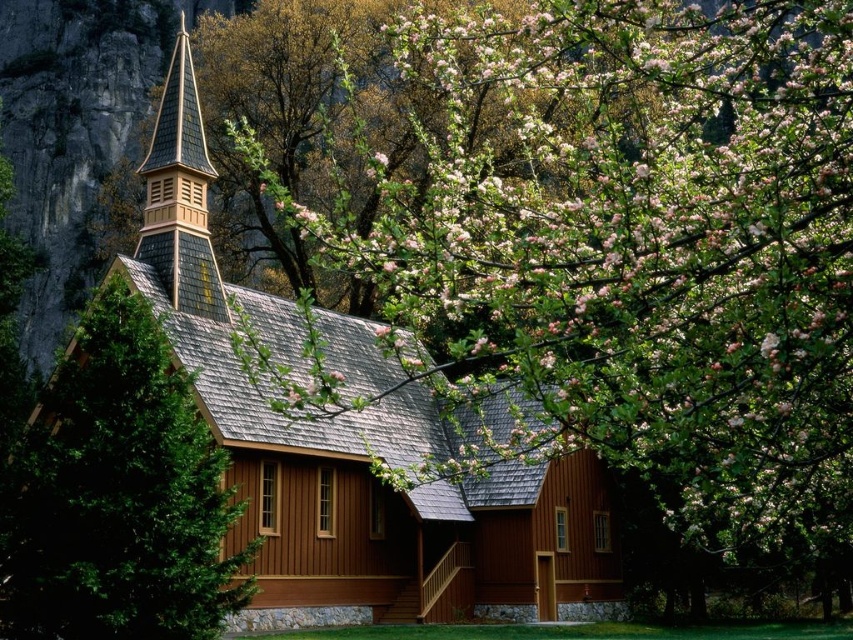
Question: Which point is closer to the camera taking this photo?

Choices:
 (A) (91, 572)
 (B) (258, 580)
 (C) (186, 65)

Answer: (A)

Question: Is brown wooden church at center thinner than shiny brown wood spire at upper left?

Choices:
 (A) yes
 (B) no

Answer: (B)

Question: Among these points, which one is farthest from the camera?

Choices:
 (A) (167, 348)
 (B) (485, 612)
 (C) (192, 170)

Answer: (B)

Question: Which point is closer to the camera?

Choices:
 (A) shiny brown wood spire at upper left
 (B) green textured pine tree at left
 (C) brown wooden church at center

Answer: (B)

Question: Does green textured pine tree at left have a smaller size compared to shiny brown wood spire at upper left?

Choices:
 (A) yes
 (B) no

Answer: (A)

Question: Does brown wooden church at center have a larger size compared to shiny brown wood spire at upper left?

Choices:
 (A) yes
 (B) no

Answer: (A)